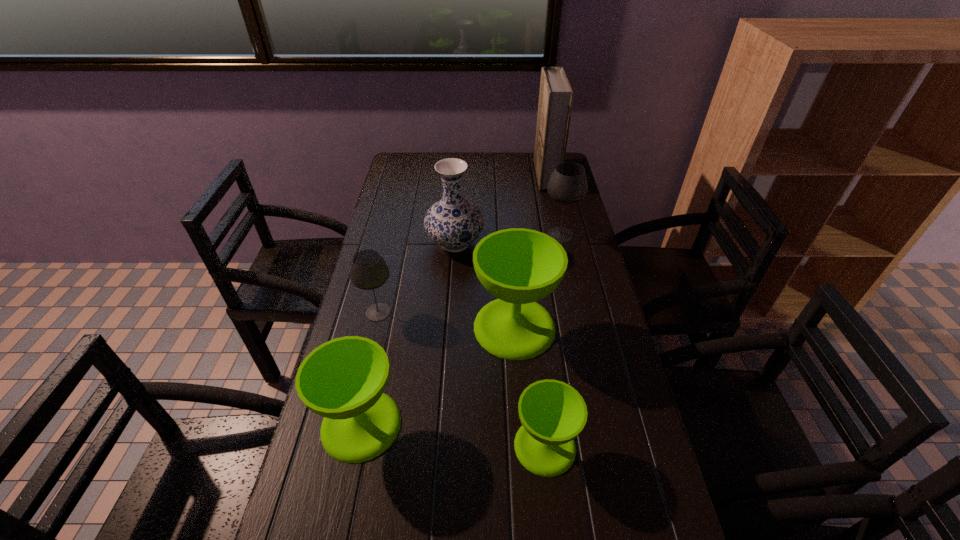
Locate an element on the screen. Image resolution: width=960 pixels, height=540 pixels. the farthest object is located at coordinates (556, 95).

Identify the location of phonebook. (556, 95).

Locate an element on the screen. Image resolution: width=960 pixels, height=540 pixels. vase is located at coordinates (453, 222).

Locate an element on the screen. The height and width of the screenshot is (540, 960). the rightmost wineglass is located at coordinates click(568, 184).

What are the coordinates of `the right gray wineglass` in the screenshot? It's located at (568, 184).

You are a GUI agent. You are given a task and a screenshot of the screen. Output one action in this format:
    pyautogui.click(x=<x>, y=<y>)
    Task: Click on the farthest green wineglass
    
    Given the screenshot: What is the action you would take?
    pyautogui.click(x=519, y=266)

What are the coordinates of `the leftmost green wineglass` in the screenshot? It's located at (343, 380).

Find the location of a particular element. the nearer gray wineglass is located at coordinates (368, 271).

At what (x,y) coordinates should I click in order to perform the action: click on the left gray wineglass. Please return your answer as a coordinate pair (x, y). This screenshot has width=960, height=540. Looking at the image, I should click on (368, 271).

I want to click on the shortest wineglass, so click(x=552, y=413).